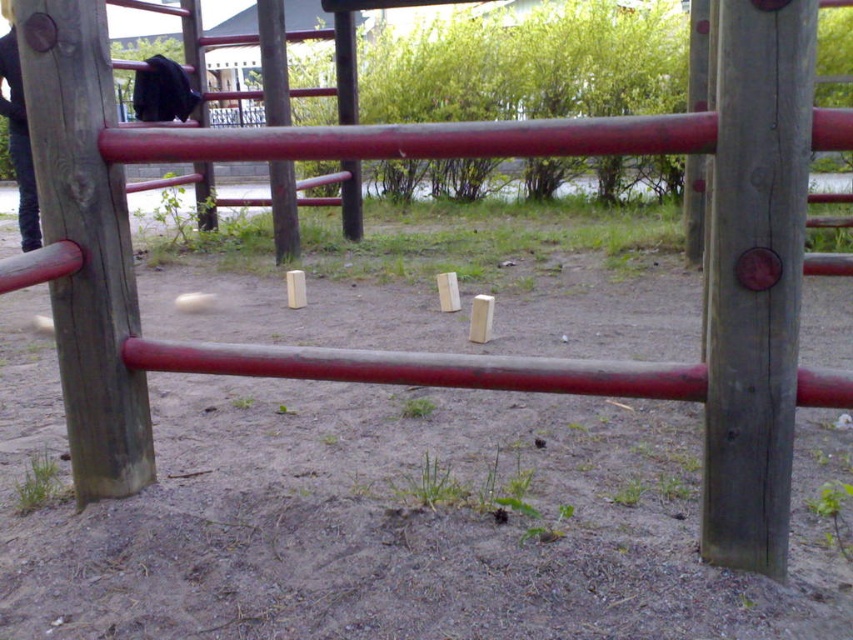
This screenshot has width=853, height=640. What do you see at coordinates (755, 276) in the screenshot?
I see `smooth wood pole at center` at bounding box center [755, 276].

Which of these two, smooth wood pole at center or wooden pole at center, stands shorter?

wooden pole at center

At what (x,y) coordinates should I click in order to perform the action: click on smooth wood pole at center. Please return your answer as a coordinate pair (x, y). The height and width of the screenshot is (640, 853). Looking at the image, I should click on (755, 276).

Which is more to the left, smooth wood pole at center or brushed wood pole at center?

Positioned to the left is brushed wood pole at center.

Who is more forward, (x=733, y=177) or (x=354, y=115)?

Point (x=733, y=177) is in front.

Find the location of a particular element. The height and width of the screenshot is (640, 853). smooth wood pole at center is located at coordinates (755, 276).

Does point (773, 28) come farther from viewer compared to point (91, 442)?

No, it is in front of (91, 442).

Between smooth wood pole at center and wooden pole at left, which one appears on the left side from the viewer's perspective?

Positioned to the left is wooden pole at left.

I want to click on smooth wood pole at center, so click(x=755, y=276).

The width and height of the screenshot is (853, 640). Identify the location of smooth wood pole at center. (755, 276).